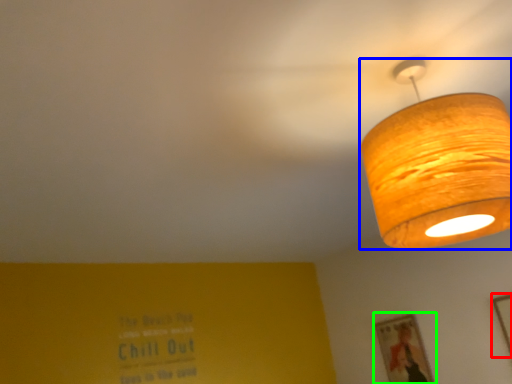
Question: Which object is positioned farthest from picture frame (highlighted by a red box)? Select from lamp (highlighted by a blue box) and picture frame (highlighted by a green box).

Choices:
 (A) lamp
 (B) picture frame

Answer: (A)